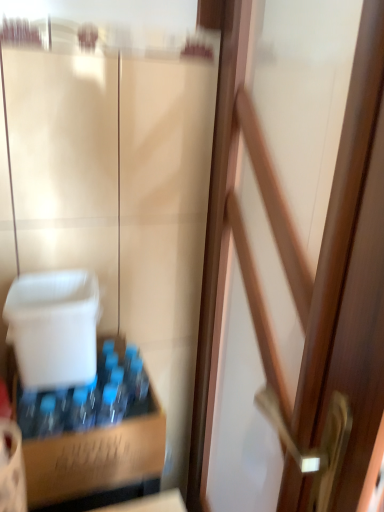
Question: Choose the correct answer: Is brown cardboard box at lower left inside wooden door at center or outside it?

Choices:
 (A) outside
 (B) inside

Answer: (A)

Question: From the image's perspective, is brown cardboard box at lower left positioned above or below wooden door at center?

Choices:
 (A) below
 (B) above

Answer: (A)

Question: From their relative heights in the image, would you say brown cardboard box at lower left is taller or shorter than wooden door at center?

Choices:
 (A) tall
 (B) short

Answer: (B)

Question: Is wooden door at center in front of or behind brown cardboard box at lower left in the image?

Choices:
 (A) front
 (B) behind

Answer: (A)

Question: Considering the positions of wooden door at center and brown cardboard box at lower left in the image, is wooden door at center bigger or smaller than brown cardboard box at lower left?

Choices:
 (A) small
 (B) big

Answer: (B)

Question: From a real-world perspective, is wooden door at center positioned above or below brown cardboard box at lower left?

Choices:
 (A) above
 (B) below

Answer: (A)

Question: Is wooden door at center inside or outside of brown cardboard box at lower left?

Choices:
 (A) inside
 (B) outside

Answer: (B)